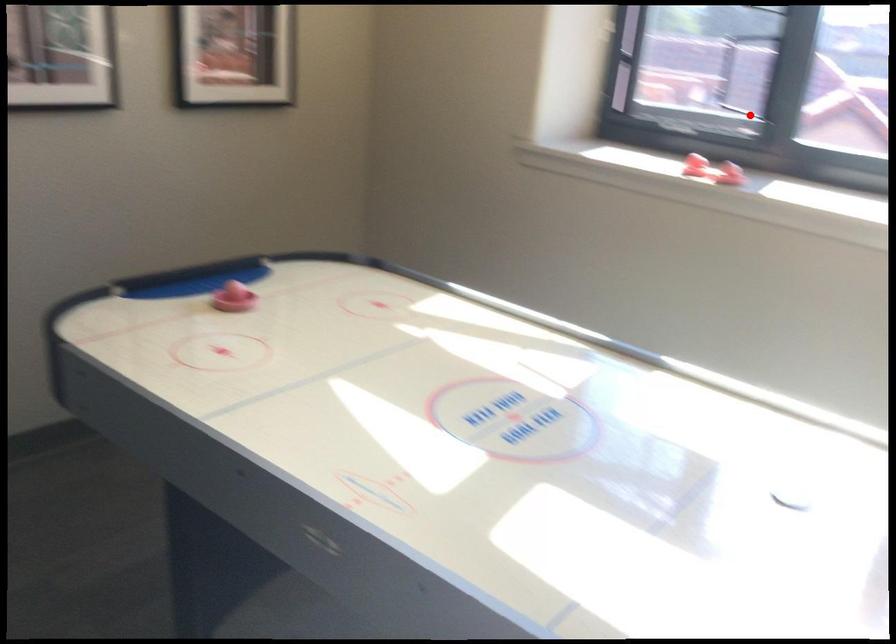
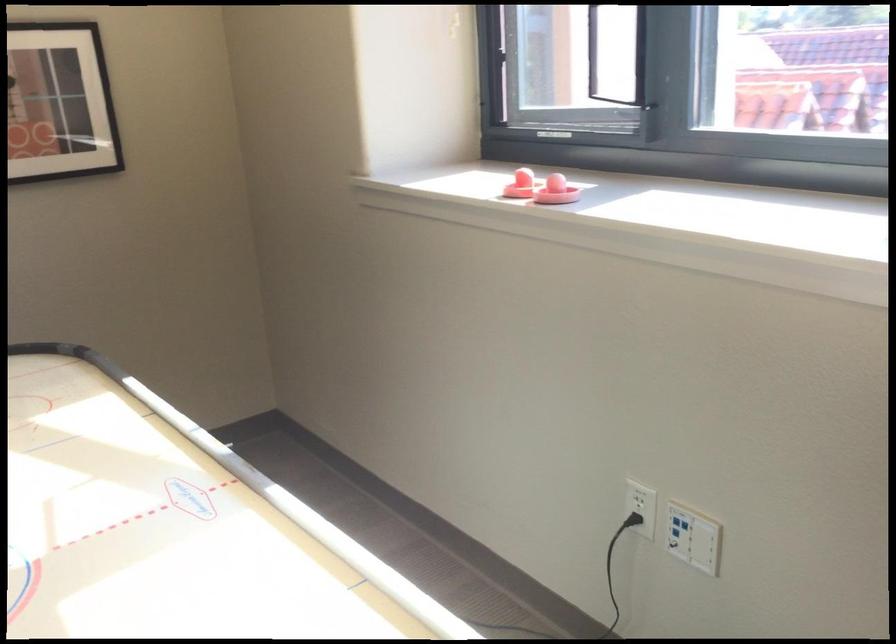
In the second image, find the point that corresponds to the highlighted location in the first image.

(638, 102)